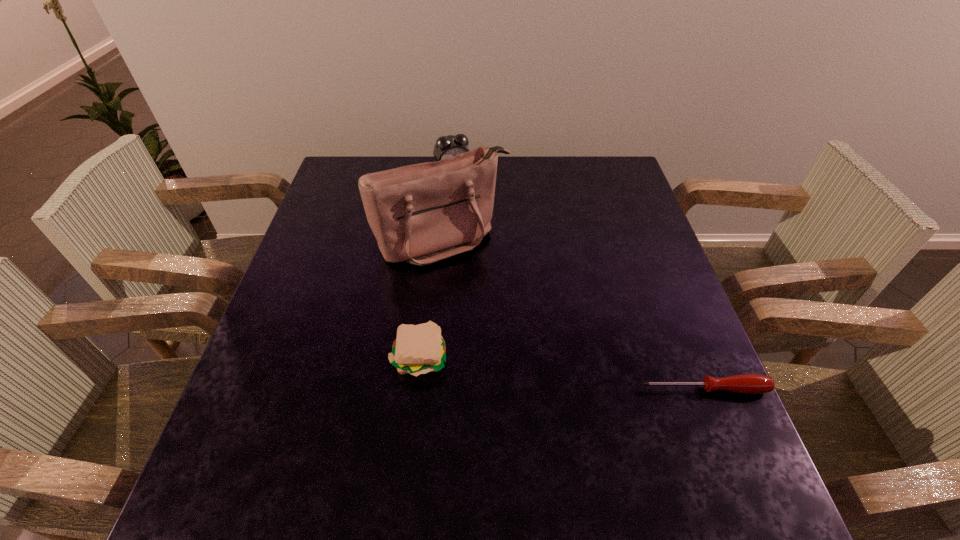
Where is `vacant spot on the desktop that is between the patty and the rightmost object and is positioned on the front pocket of the second farthest object`? The height and width of the screenshot is (540, 960). vacant spot on the desktop that is between the patty and the rightmost object and is positioned on the front pocket of the second farthest object is located at coordinates (533, 370).

Locate an element on the screen. free spot on the desktop that is between the patty and the rightmost object and is positioned on the front side of the second tallest object is located at coordinates (565, 374).